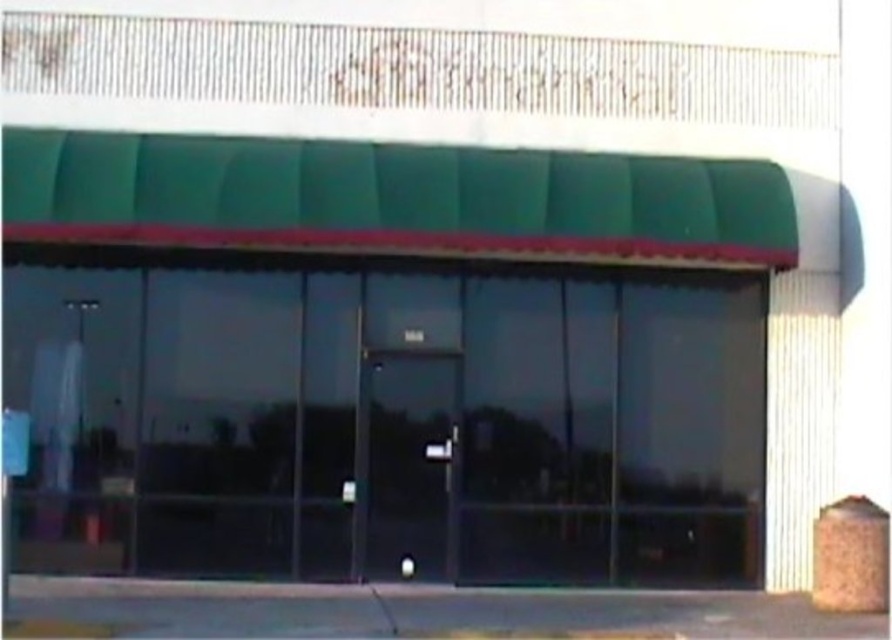
Which of these two, transparent glass window at center or transparent glass door at center, stands shorter?

With less height is transparent glass door at center.

Does transparent glass window at center have a lesser height compared to transparent glass door at center?

No, transparent glass window at center is not shorter than transparent glass door at center.

The width and height of the screenshot is (892, 640). Identify the location of transparent glass window at center. (389, 422).

Find the location of a particular element. transparent glass window at center is located at coordinates (389, 422).